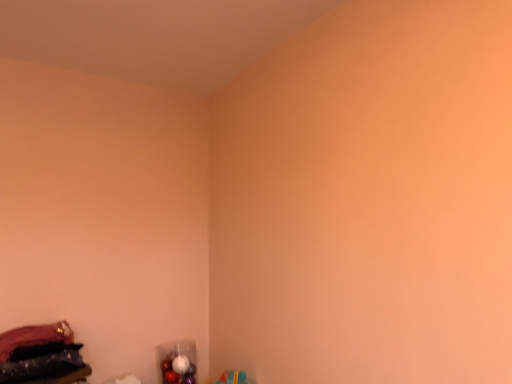
Find the location of `velvet purple fabric at lower left`. velvet purple fabric at lower left is located at coordinates (40, 354).

Describe the element at coordinates (40, 354) in the screenshot. I see `velvet purple fabric at lower left` at that location.

I want to click on velvet purple fabric at lower left, so click(40, 354).